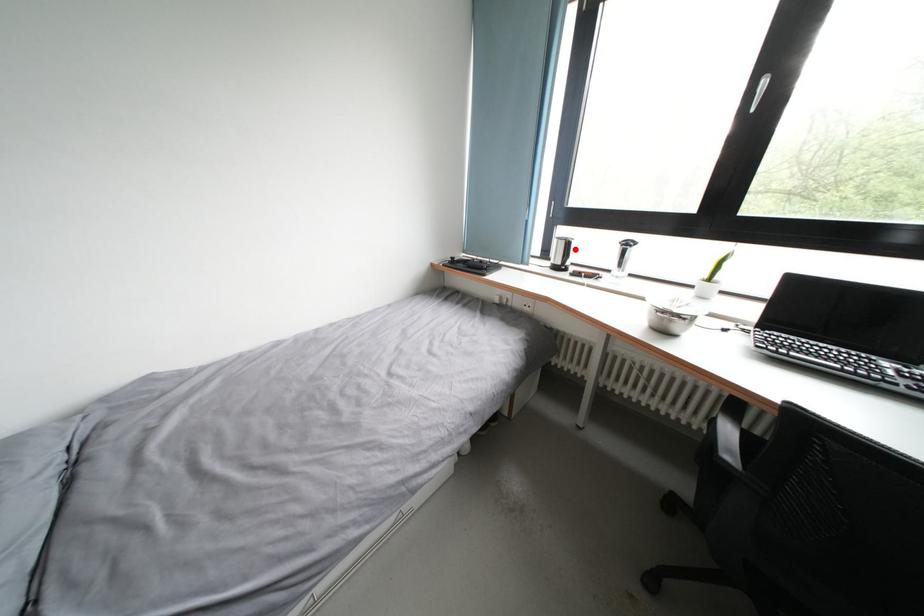
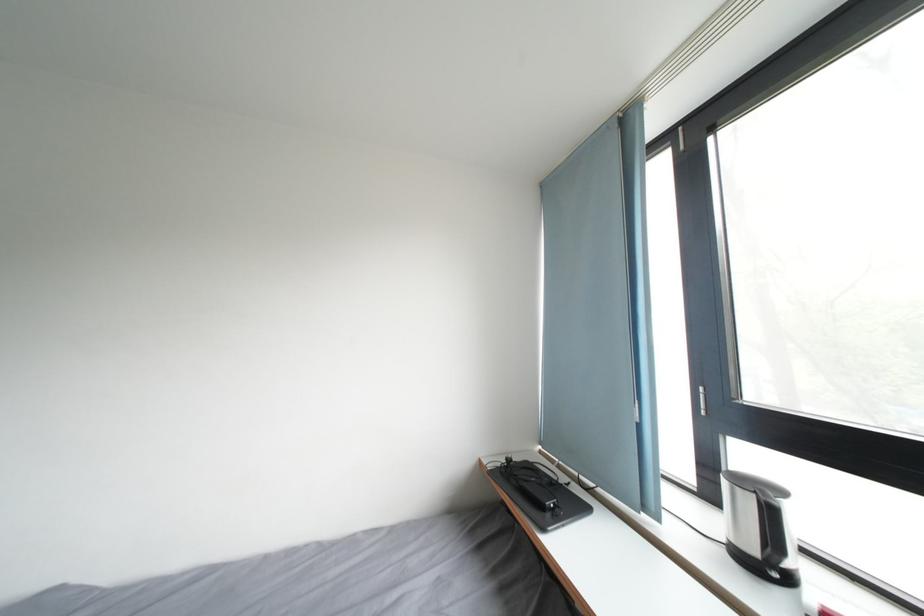
In the second image, find the point that corresponds to the highlighted location in the first image.

(776, 517)